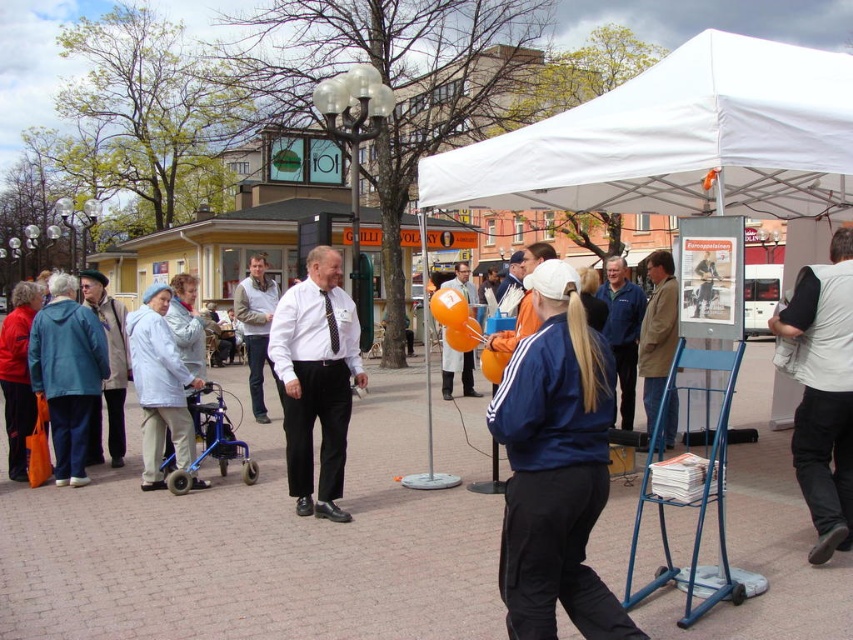
How distant is white fabric canopy at upper center from light blue fabric jacket at left?

white fabric canopy at upper center and light blue fabric jacket at left are 3.89 meters apart from each other.

Which is more to the right, white fabric canopy at upper center or light blue fabric jacket at left?

white fabric canopy at upper center

Does point (670, 124) come farther from viewer compared to point (181, 452)?

No, it is not.

This screenshot has width=853, height=640. What are the coordinates of `white fabric canopy at upper center` in the screenshot? It's located at (676, 140).

Which of these two, white fabric tent at upper right or white shirt and tie at center, stands shorter?

Standing shorter between the two is white shirt and tie at center.

Between white fabric tent at upper right and white shirt and tie at center, which one has more height?

white fabric tent at upper right is taller.

Does point (734, 120) come behind point (347, 385)?

That is False.

Find the location of a particular element. white fabric tent at upper right is located at coordinates (677, 140).

Can you confirm if brown leather jacket at center is positioned to the left of blue jacket at center?

In fact, brown leather jacket at center is to the right of blue jacket at center.

Can you confirm if brown leather jacket at center is positioned to the right of blue jacket at center?

Correct, you'll find brown leather jacket at center to the right of blue jacket at center.

Which is in front, point (669, 259) or point (633, 371)?

Point (669, 259)

Locate an element on the screen. The height and width of the screenshot is (640, 853). brown leather jacket at center is located at coordinates (657, 332).